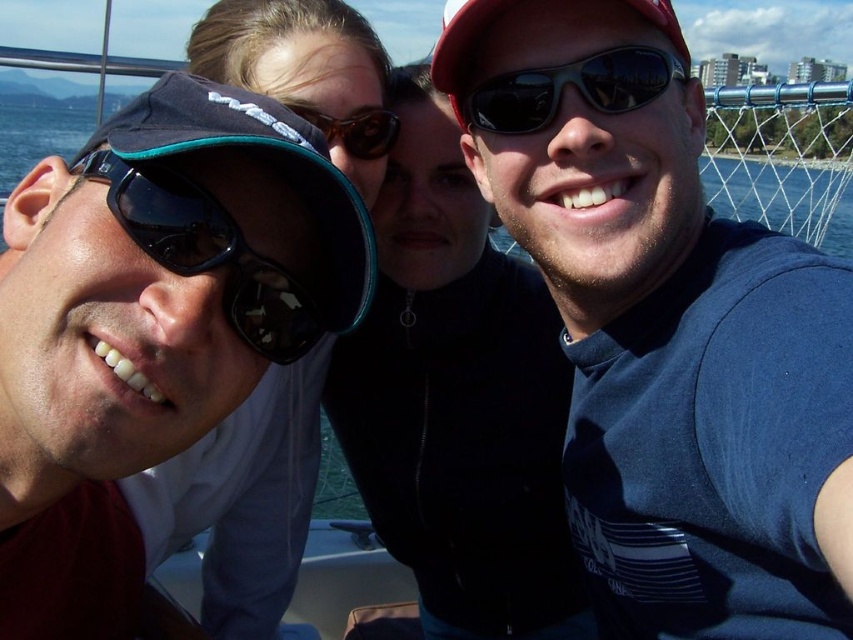
You are a photographer taking a picture of the three people in the scene. You need to adjust your focus so that both point (595, 97) and point (349, 131) are in focus. Which point should you focus on first to ensure both are sharp?

You should focus on point (595, 97) first because it is closer to the camera than point (349, 131), allowing the depth of field to cover both points effectively.